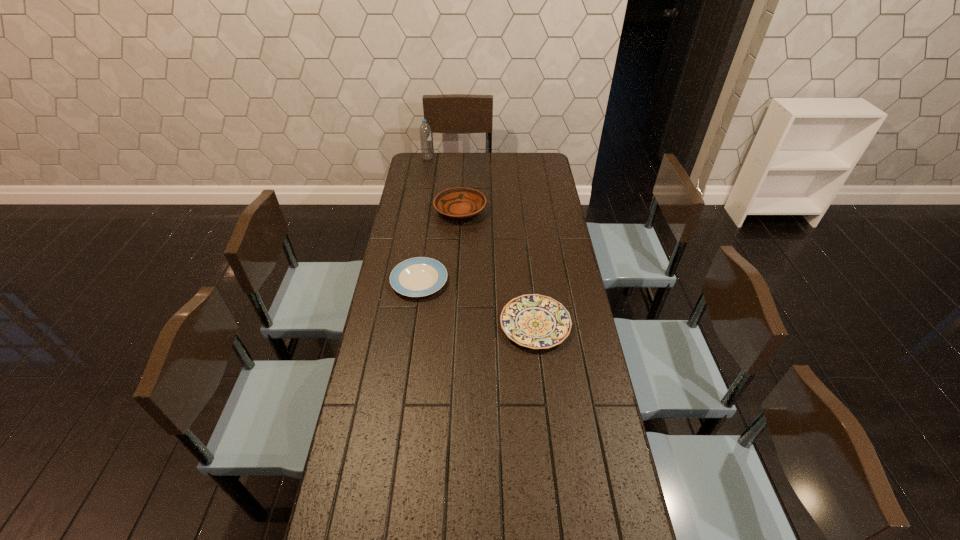
Where is `the tallest object`? Image resolution: width=960 pixels, height=540 pixels. the tallest object is located at coordinates (425, 131).

Where is `the farthest object`? The image size is (960, 540). the farthest object is located at coordinates (425, 131).

In order to click on the tallest plate in this screenshot , I will do `click(458, 202)`.

Where is `the second tallest object`? This screenshot has height=540, width=960. the second tallest object is located at coordinates (458, 202).

Identify the location of the rightmost object. This screenshot has height=540, width=960. (534, 321).

You are a GUI agent. You are given a task and a screenshot of the screen. Output one action in this format:
    pyautogui.click(x=<x>, y=<y>)
    Task: Click on the vacant space situated 0.360m on the front of the farthest object
    The height and width of the screenshot is (540, 960).
    Given the screenshot: What is the action you would take?
    pyautogui.click(x=420, y=201)

Identify the location of free location located 0.230m on the front of the second farthest object. The height and width of the screenshot is (540, 960). (457, 262).

Where is `free space located 0.300m on the left of the rightmost plate`? free space located 0.300m on the left of the rightmost plate is located at coordinates (412, 325).

At what (x,y) coordinates should I click in order to perform the action: click on object at the far edge. Please return your answer as a coordinate pair (x, y). The height and width of the screenshot is (540, 960). Looking at the image, I should click on (425, 131).

Find the location of `water bottle present at the left edge`. water bottle present at the left edge is located at coordinates (425, 131).